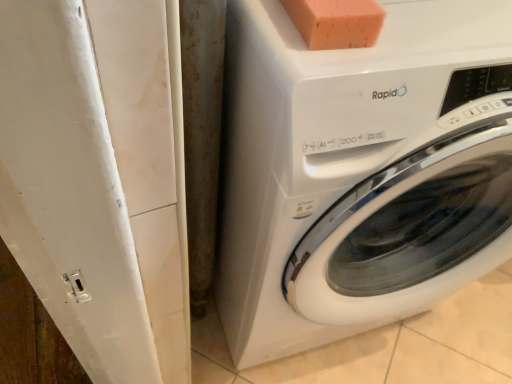
This screenshot has width=512, height=384. What do you see at coordinates (360, 171) in the screenshot?
I see `white glossy washing machine at center` at bounding box center [360, 171].

Image resolution: width=512 pixels, height=384 pixels. What are the coordinates of `white glossy washing machine at center` in the screenshot? It's located at (360, 171).

The image size is (512, 384). In order to click on white glossy washing machine at center in this screenshot , I will do `click(360, 171)`.